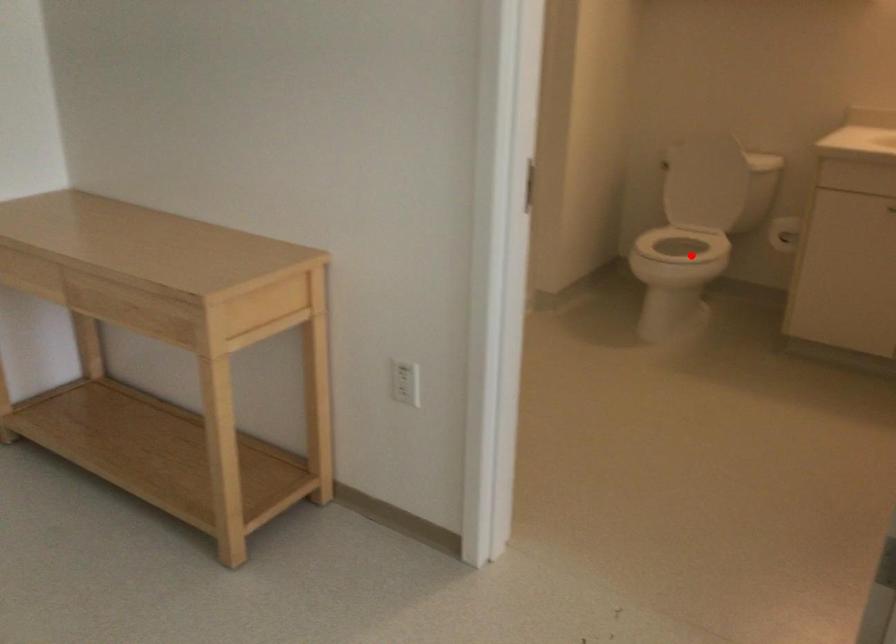
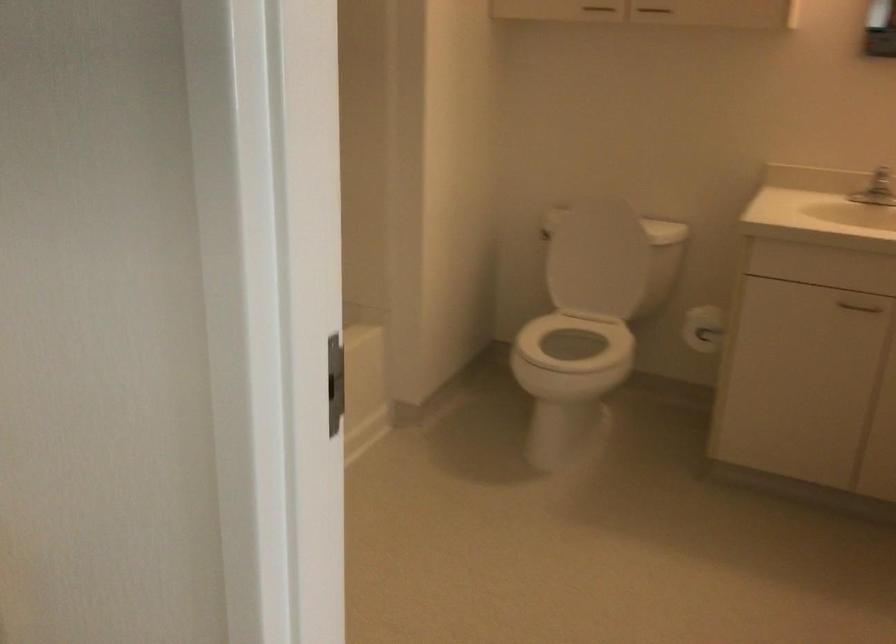
Question: I am providing you with two images of the same scene from different viewpoints. A red point is shown in image1. For the corresponding object point in image2, is it positioned nearer or farther from the camera?

Choices:
 (A) Nearer
 (B) Farther

Answer: (A)